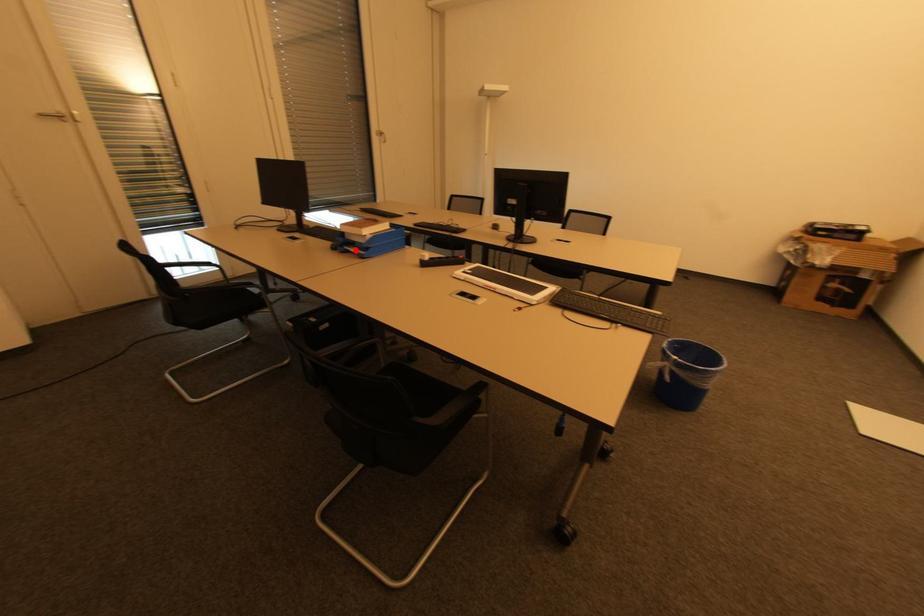
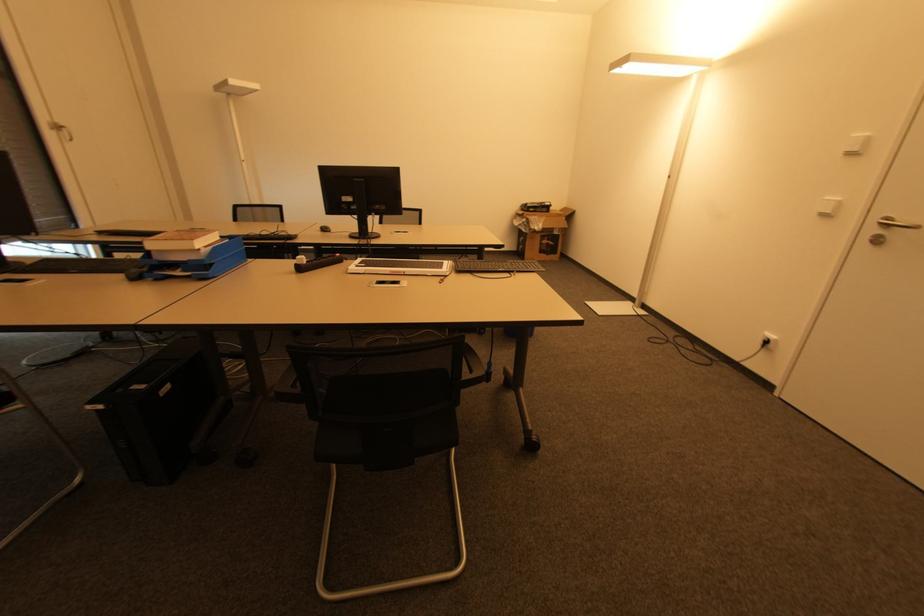
Question: I am providing you with two images of the same scene from different viewpoints. A red point is marked on the first image. At the location where the point appears in image 1, is it still visible in image 2?

Choices:
 (A) Yes
 (B) No

Answer: (A)